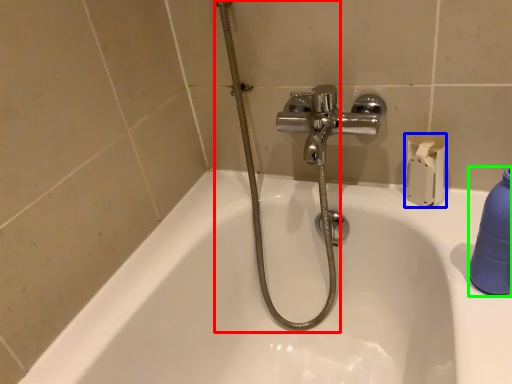
Question: Based on their relative distances, which object is nearer to shower (highlighted by a red box)? Choose from toilet paper (highlighted by a blue box) and cleaning product (highlighted by a green box).

Choices:
 (A) toilet paper
 (B) cleaning product

Answer: (A)